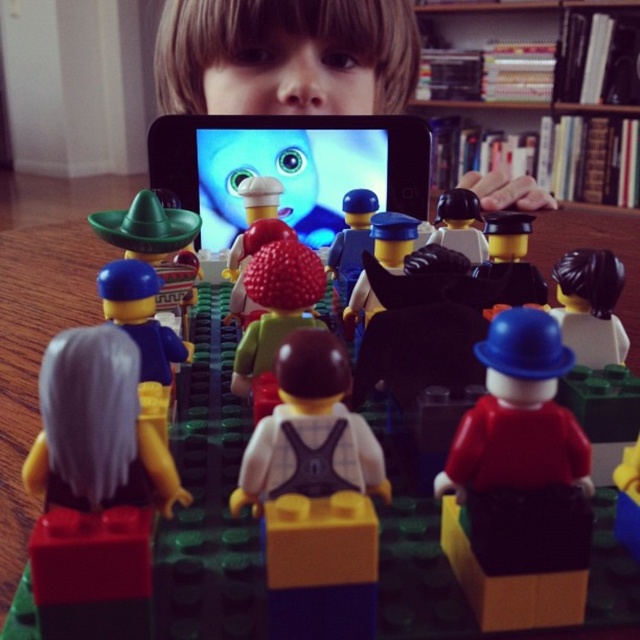
Question: Is the position of green plastic sombrero at left less distant than that of matte blue plastic figure at left?

Choices:
 (A) yes
 (B) no

Answer: (B)

Question: Which of these objects is positioned closest to the matte red shirt at center?

Choices:
 (A) green plastic sombrero at left
 (B) matte blue plastic figure at left

Answer: (B)

Question: Is matte black phone at upper center to the right of wooden bookshelf at upper center from the viewer's perspective?

Choices:
 (A) no
 (B) yes

Answer: (A)

Question: Does smooth black minifigure at center have a smaller size compared to white matte minifigure at center?

Choices:
 (A) no
 (B) yes

Answer: (B)

Question: Which point is closer to the camera taking this photo?

Choices:
 (A) (200, 77)
 (B) (593, 268)
 (C) (97, 284)
 (D) (506, 246)

Answer: (C)

Question: Which object is closer to the camera taking this photo?

Choices:
 (A) smooth black hat at center
 (B) matte blue plastic figure at left
 (C) green plastic sombrero at left

Answer: (B)